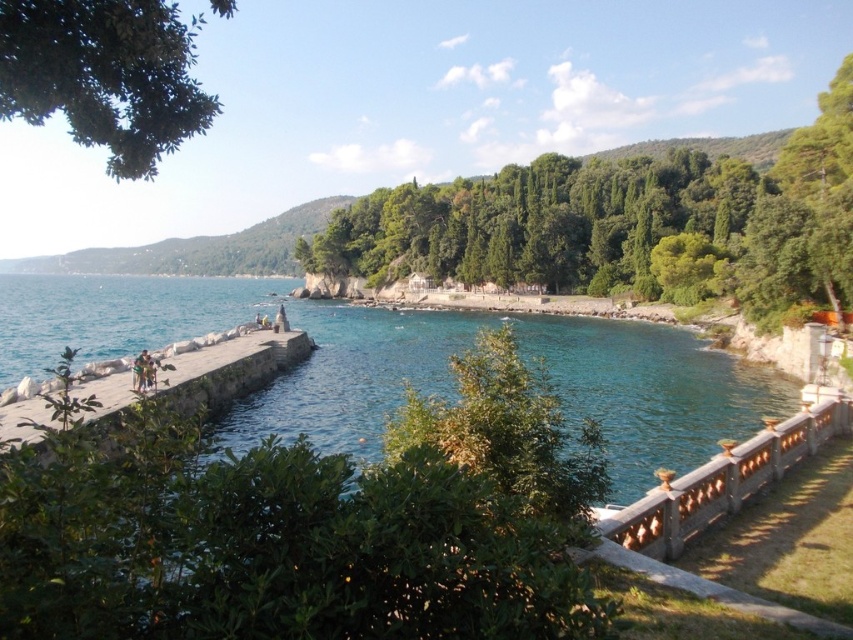
Question: Estimate the real-world distances between objects in this image. Which object is farther from the light brown wooden bench at lower left?

Choices:
 (A) green leafy tree at center
 (B) green leafy tree at upper left

Answer: (A)

Question: Can you confirm if green leafy tree at upper left is positioned above light brown wooden bench at lower left?

Choices:
 (A) no
 (B) yes

Answer: (B)

Question: Is green leafy tree at center below light brown wooden bench at lower left?

Choices:
 (A) yes
 (B) no

Answer: (B)

Question: Which object is farther from the camera taking this photo?

Choices:
 (A) light brown wooden bench at lower left
 (B) green leafy tree at upper left
 (C) green leafy tree at center

Answer: (C)

Question: Which point is closer to the camera?

Choices:
 (A) green leafy tree at upper left
 (B) light brown wooden bench at lower left
 (C) green leafy tree at center

Answer: (A)

Question: Is green leafy tree at upper left thinner than light brown wooden bench at lower left?

Choices:
 (A) no
 (B) yes

Answer: (A)